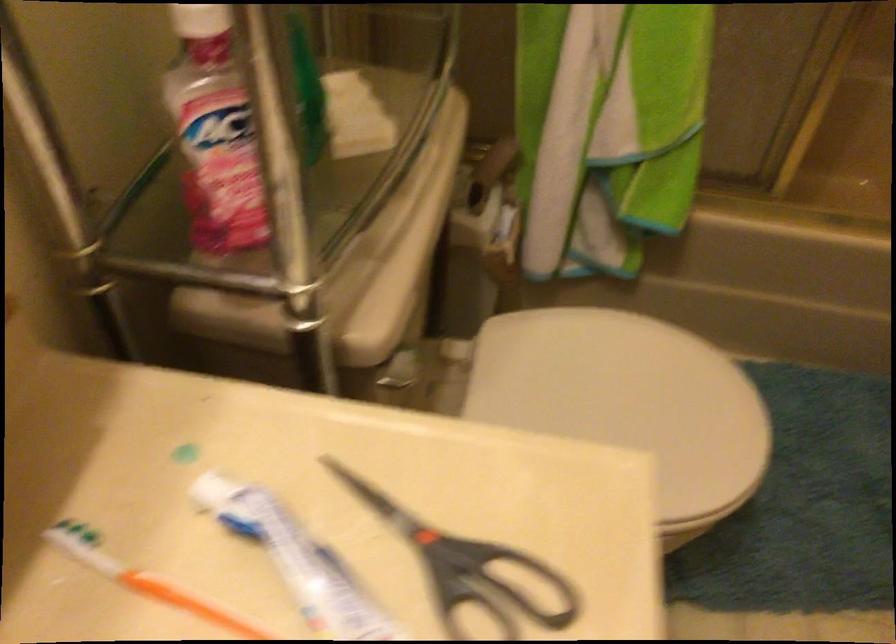
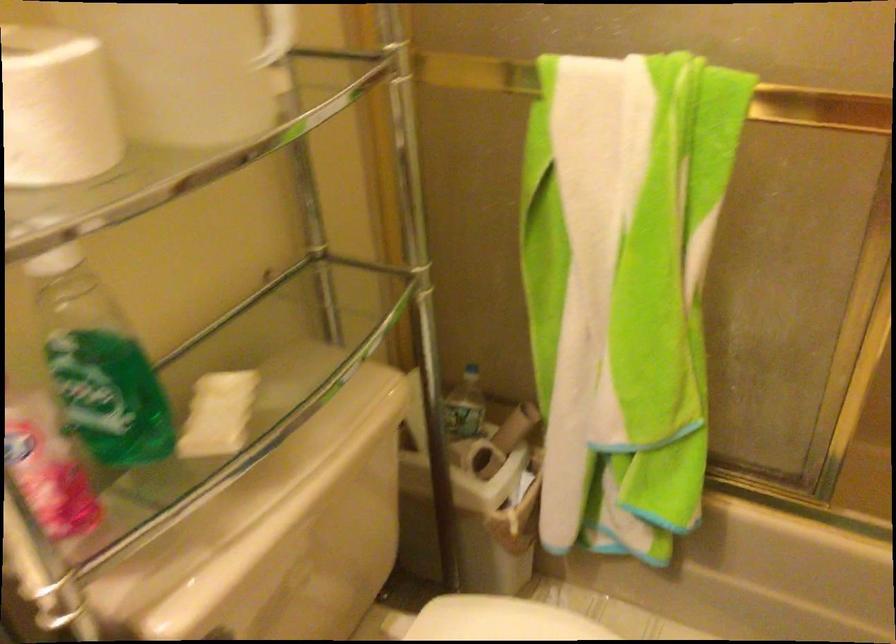
The point at (554,324) is marked in the first image. Where is the corresponding point in the second image?

(500, 620)